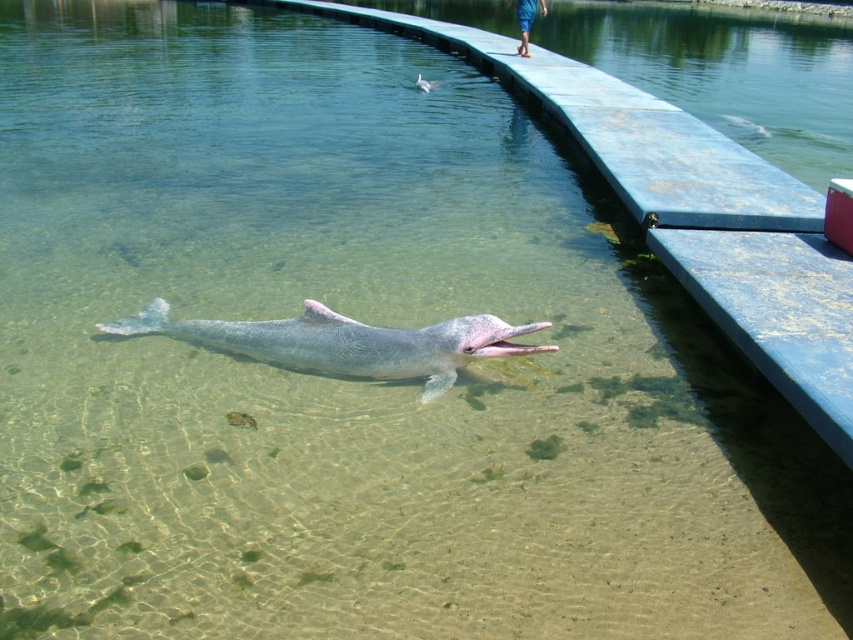
You are standing on the dock and notice the gray matte dolphin at center swimming in the water. If you want to locate it precisely, what are its coordinates?

The gray matte dolphin at center is located at coordinates point (346, 342).

Consider the image. You are standing on the dock and see a point marked at coordinates (346, 342). What object is located at that point?

The point at (346, 342) indicates the gray matte dolphin at center.

You are a marine biologist observing two dolphins in the water. You notice a gray matte dolphin at center and a pink rubber dolphin at center. Which dolphin is positioned to the left?

The gray matte dolphin at center is positioned to the left of the pink rubber dolphin at center.